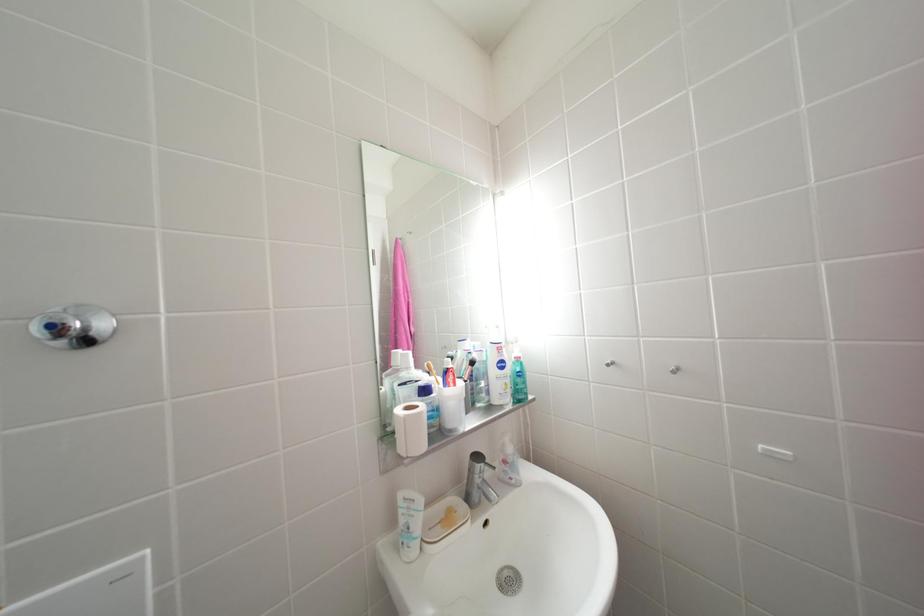
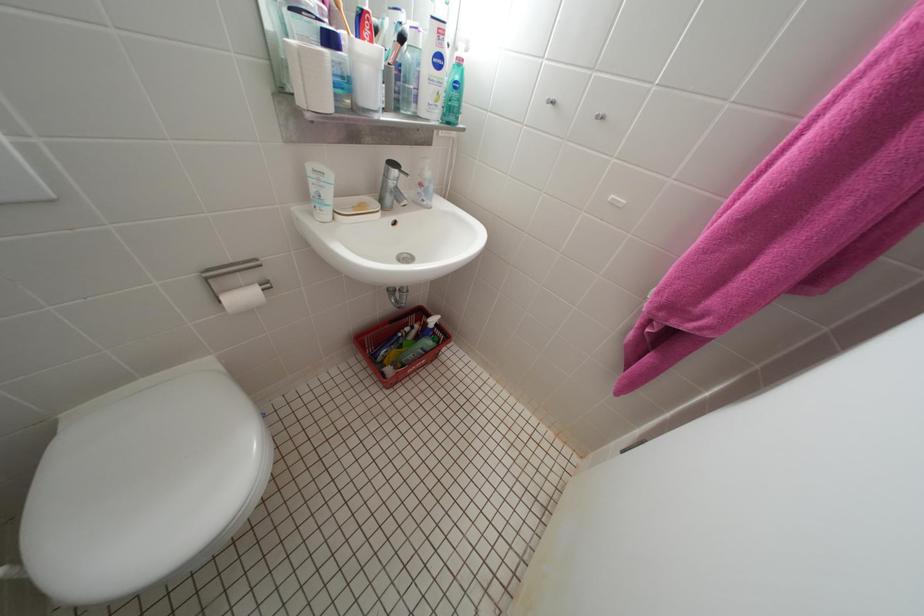
The images are taken continuously from a first-person perspective. In which direction is your viewpoint rotating?

The rotation direction of the camera is right-down.